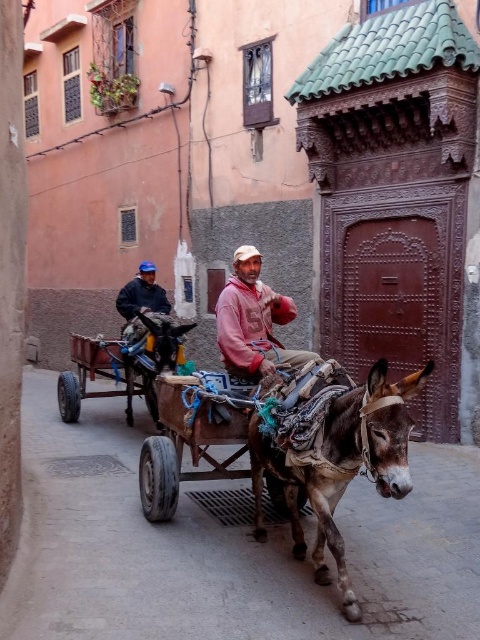
Question: Considering the real-world distances, which object is farthest from the gray-brown textured mule at center?

Choices:
 (A) rustic wooden cart at center
 (B) wooden cart at center

Answer: (B)

Question: Can you confirm if gray-brown textured mule at center is bigger than rustic wooden cart at center?

Choices:
 (A) no
 (B) yes

Answer: (B)

Question: Considering the relative positions of rustic wooden cart at center and wooden cart at center in the image provided, where is rustic wooden cart at center located with respect to wooden cart at center?

Choices:
 (A) below
 (B) above

Answer: (A)

Question: Is the position of gray-brown textured mule at center more distant than that of matte pink hoodie at center?

Choices:
 (A) no
 (B) yes

Answer: (A)

Question: Estimate the real-world distances between objects in this image. Which object is closer to the matte pink hoodie at center?

Choices:
 (A) wooden cart at center
 (B) rustic wooden cart at center
 (C) gray-brown textured mule at center

Answer: (B)

Question: Which of the following is the closest to the observer?

Choices:
 (A) [x=93, y=356]
 (B) [x=151, y=454]
 (C) [x=404, y=461]

Answer: (C)